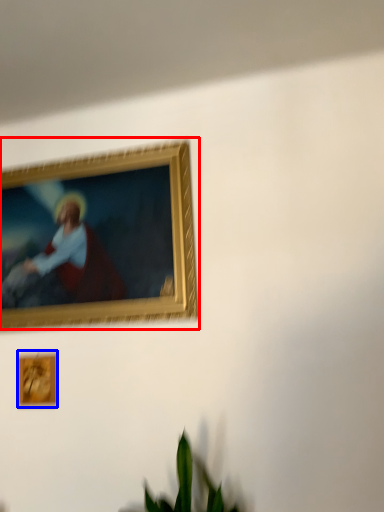
Question: Among these objects, which one is farthest to the camera, picture frame (highlighted by a red box) or picture frame (highlighted by a blue box)?

Choices:
 (A) picture frame
 (B) picture frame

Answer: (B)